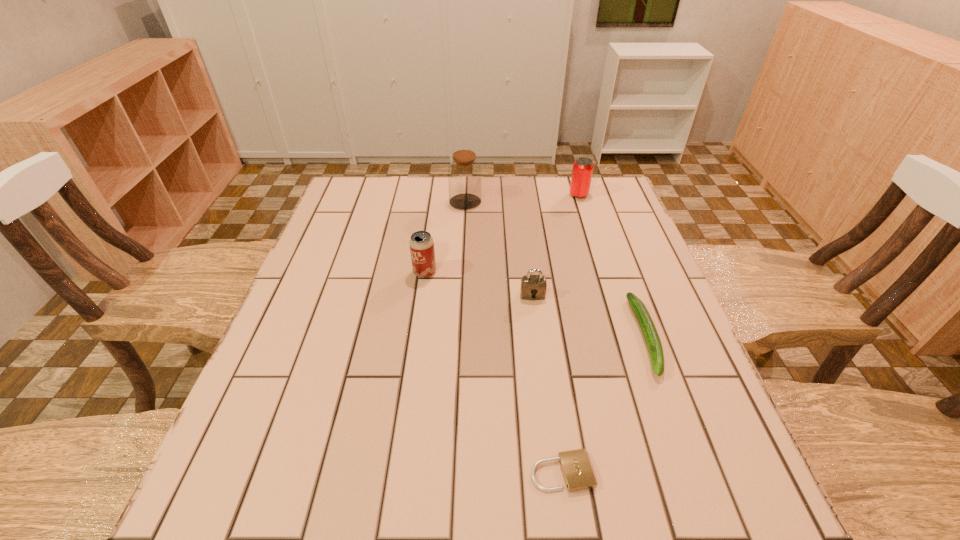
Image resolution: width=960 pixels, height=540 pixels. I want to click on the second closest object relative to the second object from right to left, so (x=533, y=287).

Where is `free space in the image that satisfies the following two spatial constraints: 1. on the front side of the nearest object; 2. on the left side of the jar`? This screenshot has height=540, width=960. free space in the image that satisfies the following two spatial constraints: 1. on the front side of the nearest object; 2. on the left side of the jar is located at coordinates (453, 472).

In order to click on vacant region that satisfies the following two spatial constraints: 1. on the front side of the jar; 2. on the right side of the nearest object in this screenshot , I will do `click(453, 472)`.